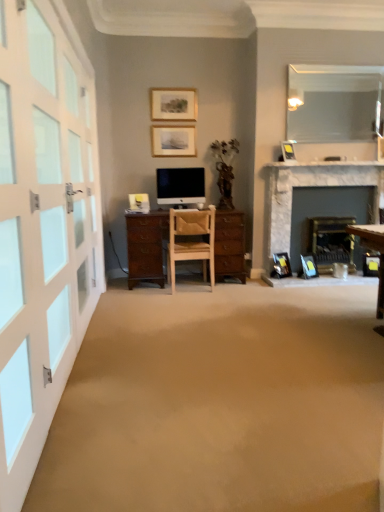
This screenshot has width=384, height=512. Find the location of `clear glass mirror at upper right`. clear glass mirror at upper right is located at coordinates (334, 103).

Measure the distance between marble fireplace at right and camera.

A distance of 4.33 meters exists between marble fireplace at right and camera.

Describe the element at coordinates (174, 104) in the screenshot. I see `matte wooden picture frame at upper center, the fifth picture frame when ordered from right to left` at that location.

You are a GUI agent. You are given a task and a screenshot of the screen. Output one action in this format:
    pyautogui.click(x=<x>, y=<y>)
    Task: Click on the matte black picture frame at lower right, which is the 2th picture frame from bottom to top
    The height and width of the screenshot is (512, 384).
    Given the screenshot: What is the action you would take?
    pyautogui.click(x=281, y=265)

What is the approximate height of light brown wooden chair at center?

The height of light brown wooden chair at center is 83.10 centimeters.

Describe the element at coordinates (180, 186) in the screenshot. The width and height of the screenshot is (384, 512). I see `matte black monitor at center` at that location.

The height and width of the screenshot is (512, 384). I want to click on clear glass mirror at upper right, so click(334, 103).

Measure the distance from clear glass mirror at upper right to blue plastic picture frame at lower right, which is the 5th picture frame from top to bottom.

The distance of clear glass mirror at upper right from blue plastic picture frame at lower right, which is the 5th picture frame from top to bottom, is 3.15 meters.

The image size is (384, 512). In order to click on the 4th picture frame below when counting from the clear glass mirror at upper right (from the image's perspective) in this screenshot , I will do `click(309, 267)`.

Between clear glass mirror at upper right and blue plastic picture frame at lower right, marked as the 1th picture frame in a bottom-to-top arrangement, which one is positioned behind?

blue plastic picture frame at lower right, marked as the 1th picture frame in a bottom-to-top arrangement, is further away from the camera.

Between clear glass mirror at upper right and blue plastic picture frame at lower right, marked as the 1th picture frame in a bottom-to-top arrangement, which one appears on the left side from the viewer's perspective?

Positioned to the left is blue plastic picture frame at lower right, marked as the 1th picture frame in a bottom-to-top arrangement.

Considering the positions of objects matte wooden picture frame at upper center, the fifth picture frame when ordered from right to left, and matte black monitor at center in the image provided, who is more to the left, matte wooden picture frame at upper center, the fifth picture frame when ordered from right to left, or matte black monitor at center?

From the viewer's perspective, matte wooden picture frame at upper center, the fifth picture frame when ordered from right to left, appears more on the left side.

Is matte wooden picture frame at upper center, which is counted as the 5th picture frame, starting from the bottom, positioned behind matte black monitor at center?

That is True.

Is matte wooden picture frame at upper center, which is counted as the 5th picture frame, starting from the bottom, facing away from matte black monitor at center?

No, matte wooden picture frame at upper center, which is counted as the 5th picture frame, starting from the bottom, is not facing the opposite direction of matte black monitor at center.

From a real-world perspective, is matte wooden picture frame at upper center, which is counted as the 1th picture frame, starting from the left, positioned under matte black monitor at center based on gravity?

No, from a real-world perspective, matte wooden picture frame at upper center, which is counted as the 1th picture frame, starting from the left, is not below matte black monitor at center.

From a real-world perspective, who is located higher, white glass door at left or light brown wooden chair at center?

white glass door at left.

In the image, is white glass door at left positioned in front of or behind light brown wooden chair at center?

white glass door at left is positioned closer to the viewer than light brown wooden chair at center.

Does white glass door at left have a lesser width compared to light brown wooden chair at center?

Correct, the width of white glass door at left is less than that of light brown wooden chair at center.

Can you tell me how much white glass door at left and light brown wooden chair at center differ in facing direction?

There is a 92-degree angle between the facing directions of white glass door at left and light brown wooden chair at center.

Is marble fireplace at right oriented away from matte wooden picture frame at upper center, which is counted as the 1th picture frame, starting from the left?

marble fireplace at right does not have its back to matte wooden picture frame at upper center, which is counted as the 1th picture frame, starting from the left.

From a real-world perspective, does marble fireplace at right stand above matte wooden picture frame at upper center, which is counted as the 5th picture frame, starting from the bottom?

No.

Based on the photo, which is more to the right, marble fireplace at right or matte wooden picture frame at upper center, arranged as the 1th picture frame when viewed from the top?

marble fireplace at right is more to the right.

What's the angular difference between light brown wooden chair at center and blue plastic picture frame at lower right, which appears as the first picture frame when viewed from the right,'s facing directions?

The angle between the facing direction of light brown wooden chair at center and the facing direction of blue plastic picture frame at lower right, which appears as the first picture frame when viewed from the right, is 153 degrees.

From a real-world perspective, is light brown wooden chair at center on top of blue plastic picture frame at lower right, arranged as the 5th picture frame when viewed from the left?

Indeed, from a real-world perspective, light brown wooden chair at center stands above blue plastic picture frame at lower right, arranged as the 5th picture frame when viewed from the left.

Is light brown wooden chair at center positioned beyond the bounds of blue plastic picture frame at lower right, arranged as the 5th picture frame when viewed from the left?

Yes, light brown wooden chair at center is located beyond the bounds of blue plastic picture frame at lower right, arranged as the 5th picture frame when viewed from the left.

Is the position of light brown wooden chair at center less distant than that of blue plastic picture frame at lower right, arranged as the 5th picture frame when viewed from the left?

Yes, light brown wooden chair at center is in front of blue plastic picture frame at lower right, arranged as the 5th picture frame when viewed from the left.

Would you say matte wooden picture frame at upper center, acting as the 2th picture frame starting from the left, is part of clear glass mirror at upper right's contents?

No, clear glass mirror at upper right does not contain matte wooden picture frame at upper center, acting as the 2th picture frame starting from the left.

Looking at their sizes, would you say clear glass mirror at upper right is wider or thinner than matte wooden picture frame at upper center, the second picture frame from the top?

Result: In the image, clear glass mirror at upper right appears to be more narrow than matte wooden picture frame at upper center, the second picture frame from the top.

What's the angular difference between clear glass mirror at upper right and matte wooden picture frame at upper center, which is the fourth picture frame from bottom to top,'s facing directions?

The angle between the facing direction of clear glass mirror at upper right and the facing direction of matte wooden picture frame at upper center, which is the fourth picture frame from bottom to top, is 0.914 degrees.

Which picture frame is the 4th one when counting from the back of the clear glass mirror at upper right? Please provide its 2D coordinates.

[(173, 141)]

In terms of width, does white glass door at left look wider or thinner when compared to matte black picture frame at upper center, arranged as the second picture frame when viewed from the right?

white glass door at left is thinner than matte black picture frame at upper center, arranged as the second picture frame when viewed from the right.

Would you say white glass door at left is outside matte black picture frame at upper center, placed as the 3th picture frame when sorted from bottom to top?

Yes, white glass door at left is not within matte black picture frame at upper center, placed as the 3th picture frame when sorted from bottom to top.

Which is more to the right, white glass door at left or matte black picture frame at upper center, placed as the 3th picture frame when sorted from bottom to top?

Positioned to the right is matte black picture frame at upper center, placed as the 3th picture frame when sorted from bottom to top.

You are a GUI agent. You are given a task and a screenshot of the screen. Output one action in this format:
    pyautogui.click(x=<x>, y=<y>)
    Task: Click on the mirror above the blue plastic picture frame at lower right, which is the 5th picture frame from top to bottom (from the image's perspective)
    The image size is (384, 512).
    Given the screenshot: What is the action you would take?
    pyautogui.click(x=334, y=103)

Find the location of a particular element. television in front of the matte wooden picture frame at upper center, which is counted as the 5th picture frame, starting from the bottom is located at coordinates (180, 186).

Looking at this image, considering their positions, is light brown wooden chair at center positioned closer to matte black picture frame at lower right, which appears as the fourth picture frame when viewed from the top, than matte black monitor at center?

light brown wooden chair at center is positioned closer to the anchor matte black picture frame at lower right, which appears as the fourth picture frame when viewed from the top.

Estimate the real-world distances between objects in this image. Which object is further from matte black monitor at center, matte black picture frame at upper center, arranged as the second picture frame when viewed from the right, or white glass door at left?

white glass door at left is further to matte black monitor at center.

From the image, which object appears to be farther from matte wooden picture frame at upper center, which is counted as the 5th picture frame, starting from the bottom, blue plastic picture frame at lower right, marked as the 1th picture frame in a bottom-to-top arrangement, or matte black picture frame at upper center, arranged as the second picture frame when viewed from the right?

blue plastic picture frame at lower right, marked as the 1th picture frame in a bottom-to-top arrangement, lies further to matte wooden picture frame at upper center, which is counted as the 5th picture frame, starting from the bottom, than the other object.

Which object lies further to the anchor point marble fireplace at right, matte black picture frame at lower right, which is the 2th picture frame from bottom to top, or light brown wooden chair at center?

light brown wooden chair at center is positioned further to the anchor marble fireplace at right.

From the image, which object appears to be nearer to matte black picture frame at lower right, which appears as the fourth picture frame when viewed from the top, matte black monitor at center or white glass door at left?

matte black monitor at center.

Based on the photo, considering their positions, is marble fireplace at right positioned closer to white glass door at left than matte wooden picture frame at upper center, which ranks as the 4th picture frame in right-to-left order?

matte wooden picture frame at upper center, which ranks as the 4th picture frame in right-to-left order.

When comparing their distances from matte black monitor at center, does matte black picture frame at upper center, which is the third picture frame in top-to-bottom order, or clear glass mirror at upper right seem further?

The object further to matte black monitor at center is clear glass mirror at upper right.

Estimate the real-world distances between objects in this image. Which object is further from clear glass mirror at upper right, white glass door at left or blue plastic picture frame at lower right, which appears as the first picture frame when viewed from the right?

Based on the image, white glass door at left appears to be further to clear glass mirror at upper right.

At what (x,y) coordinates should I click in order to perform the action: click on television between white glass door at left and matte wooden picture frame at upper center, the fifth picture frame when ordered from right to left, in the front-back direction. Please return your answer as a coordinate pair (x, y). Image resolution: width=384 pixels, height=512 pixels. Looking at the image, I should click on (180, 186).

This screenshot has height=512, width=384. I want to click on picture frame between white glass door at left and clear glass mirror at upper right from front to back, so click(x=288, y=150).

In order to click on television between matte wooden picture frame at upper center, which is the fourth picture frame from bottom to top, and light brown wooden chair at center vertically in this screenshot , I will do `click(180, 186)`.

This screenshot has width=384, height=512. Find the location of `television between matte wooden picture frame at upper center, which is counted as the 1th picture frame, starting from the left, and clear glass mirror at upper right from left to right`. television between matte wooden picture frame at upper center, which is counted as the 1th picture frame, starting from the left, and clear glass mirror at upper right from left to right is located at coordinates (180, 186).